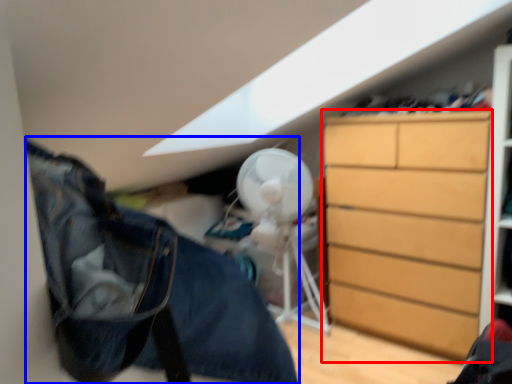
Question: Which point is closer to the camera, chest of drawers (highlighted by a red box) or clothing (highlighted by a blue box)?

Choices:
 (A) chest of drawers
 (B) clothing

Answer: (B)